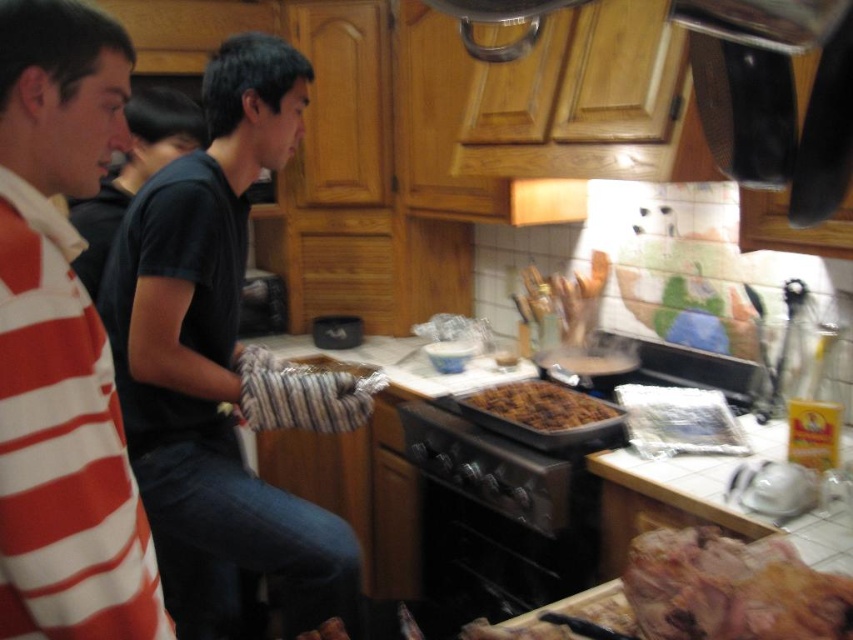
Question: Can you confirm if white striped shirt at left is wider than black matte oven at center?

Choices:
 (A) no
 (B) yes

Answer: (A)

Question: Which object is positioned farthest from the brown crumbly cake at center?

Choices:
 (A) black matte oven at center
 (B) black metal stove at center
 (C) white striped shirt at left
 (D) brown crispy meat at lower right

Answer: (C)

Question: Which point is closer to the camera?

Choices:
 (A) (753, 554)
 (B) (144, 268)
 (C) (592, 410)

Answer: (A)

Question: Does brown crispy meat at lower right appear on the right side of black matte oven at center?

Choices:
 (A) yes
 (B) no

Answer: (A)

Question: Is brown crispy meat at lower right bigger than black metal stove at center?

Choices:
 (A) no
 (B) yes

Answer: (A)

Question: Which object is the closest to the brown crispy meat at lower right?

Choices:
 (A) brown crumbly cake at center
 (B) black metal stove at center
 (C) white striped shirt at left
 (D) striped fabric oven mitt at center

Answer: (B)